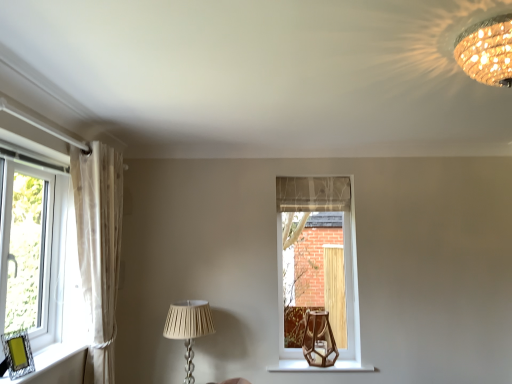
Question: Considering the relative sizes of clear glass window at left, the 1th window from the front, and brown glass table lamp at center in the image provided, is clear glass window at left, the 1th window from the front, wider than brown glass table lamp at center?

Choices:
 (A) no
 (B) yes

Answer: (A)

Question: Is clear glass window at left, placed as the 2th window when sorted from right to left, in contact with brown glass table lamp at center?

Choices:
 (A) yes
 (B) no

Answer: (B)

Question: Considering the relative sizes of clear glass window at left, placed as the 2th window when sorted from right to left, and brown glass table lamp at center in the image provided, is clear glass window at left, placed as the 2th window when sorted from right to left, smaller than brown glass table lamp at center?

Choices:
 (A) yes
 (B) no

Answer: (B)

Question: Could brown glass table lamp at center be considered to be inside clear glass window at left, which is the second window in back-to-front order?

Choices:
 (A) no
 (B) yes

Answer: (A)

Question: Does clear glass window at left, placed as the 2th window when sorted from right to left, appear on the left side of brown glass table lamp at center?

Choices:
 (A) yes
 (B) no

Answer: (A)

Question: Is point (496, 66) closer or farther from the camera than point (339, 349)?

Choices:
 (A) closer
 (B) farther

Answer: (A)

Question: Considering the positions of gold textured chandelier at upper right, acting as the 1th lamp starting from the top, and clear glass window at center, the first window when ordered from back to front, in the image, is gold textured chandelier at upper right, acting as the 1th lamp starting from the top, wider or thinner than clear glass window at center, the first window when ordered from back to front,?

Choices:
 (A) thin
 (B) wide

Answer: (B)

Question: Considering their positions, is gold textured chandelier at upper right, positioned as the first lamp in right-to-left order, located in front of or behind clear glass window at center, which is the 2th window in front-to-back order?

Choices:
 (A) behind
 (B) front

Answer: (B)

Question: From a real-world perspective, is gold textured chandelier at upper right, acting as the 1th lamp starting from the top, positioned above or below clear glass window at center, arranged as the 2th window when viewed from the left?

Choices:
 (A) above
 (B) below

Answer: (A)

Question: Considering the positions of point tap(280, 362) and point tap(495, 64), is point tap(280, 362) closer or farther from the camera than point tap(495, 64)?

Choices:
 (A) farther
 (B) closer

Answer: (A)

Question: From a real-world perspective, is wooden hexagonal vase at lower center physically located above or below gold textured chandelier at upper right, acting as the 1th lamp starting from the top?

Choices:
 (A) above
 (B) below

Answer: (B)

Question: From the image's perspective, is wooden hexagonal vase at lower center located above or below gold textured chandelier at upper right, positioned as the first lamp in right-to-left order?

Choices:
 (A) above
 (B) below

Answer: (B)

Question: Is wooden hexagonal vase at lower center taller or shorter than gold textured chandelier at upper right, the 1th lamp viewed from the front?

Choices:
 (A) short
 (B) tall

Answer: (A)

Question: Is clear glass window at center, marked as the 1th window in a right-to-left arrangement, taller or shorter than sheer white curtain at left?

Choices:
 (A) short
 (B) tall

Answer: (A)

Question: In the image, is clear glass window at center, arranged as the 2th window when viewed from the left, on the left side or the right side of sheer white curtain at left?

Choices:
 (A) left
 (B) right

Answer: (B)